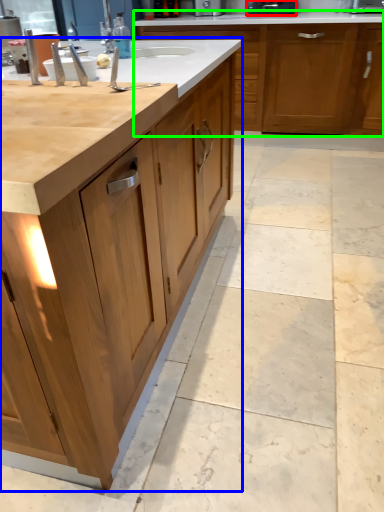
Question: Which is nearer to the appliance (highlighted by a red box)? cabinetry (highlighted by a blue box) or cabinetry (highlighted by a green box).

Choices:
 (A) cabinetry
 (B) cabinetry

Answer: (B)